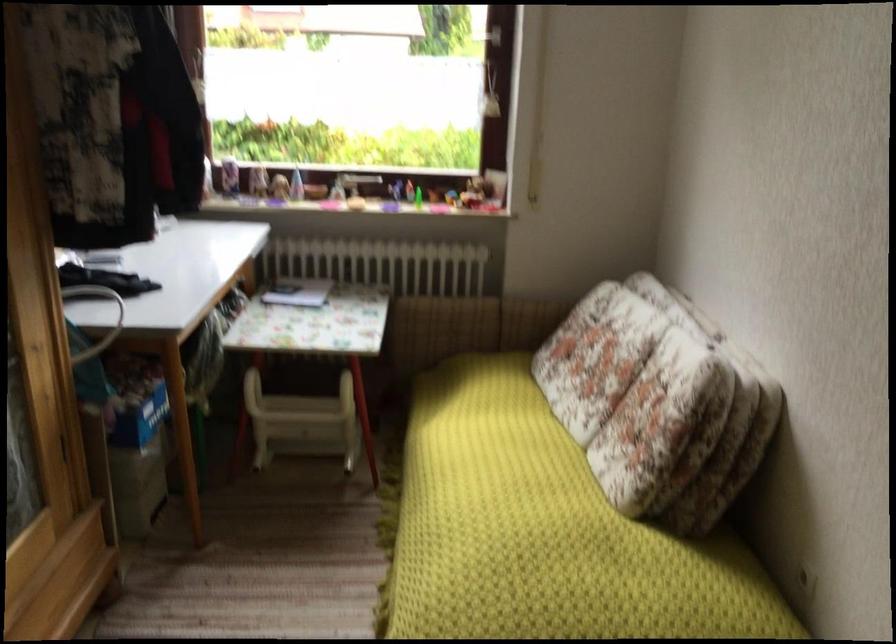
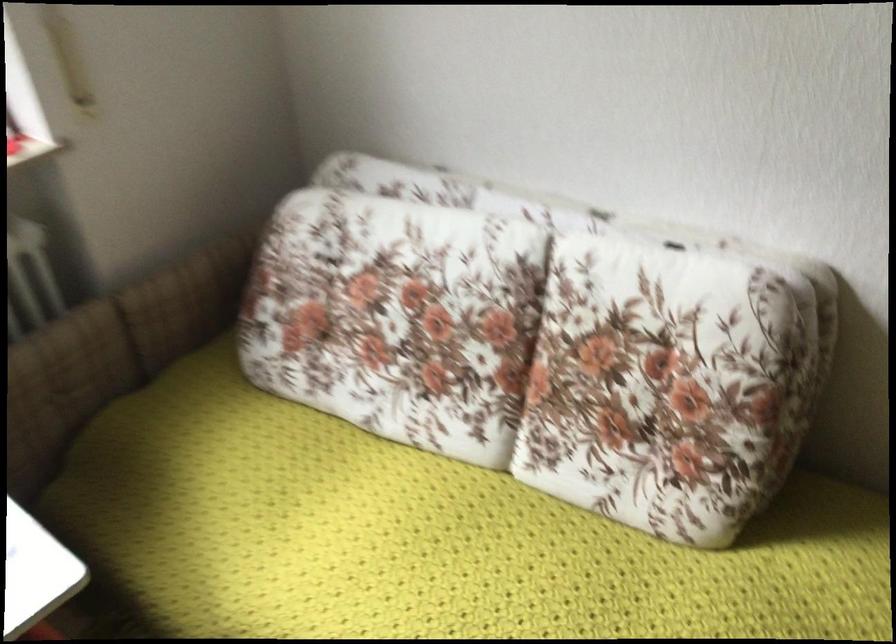
Where in the second image is the point corresponding to [450,319] from the first image?

(63, 384)